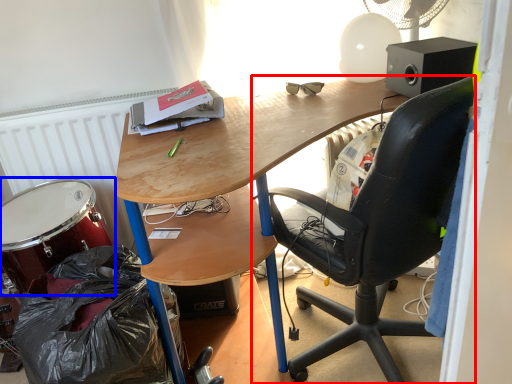
Question: Which object appears closest to the camera in this image, chair (highlighted by a red box) or drum (highlighted by a blue box)?

Choices:
 (A) chair
 (B) drum

Answer: (A)